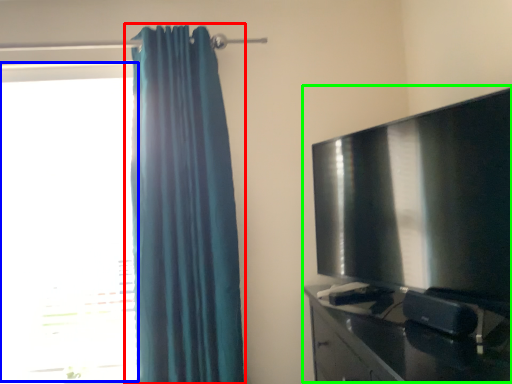
Question: Which object is positioned farthest from curtain (highlighted by a red box)? Select from window (highlighted by a blue box) and entertainment center (highlighted by a green box).

Choices:
 (A) window
 (B) entertainment center

Answer: (B)